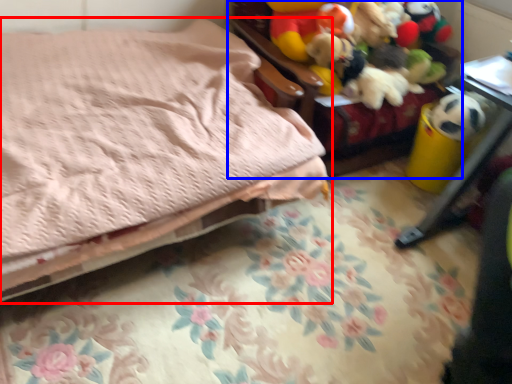
Question: Which object appears farthest to the camera in this image, bed (highlighted by a red box) or furniture (highlighted by a blue box)?

Choices:
 (A) bed
 (B) furniture

Answer: (B)